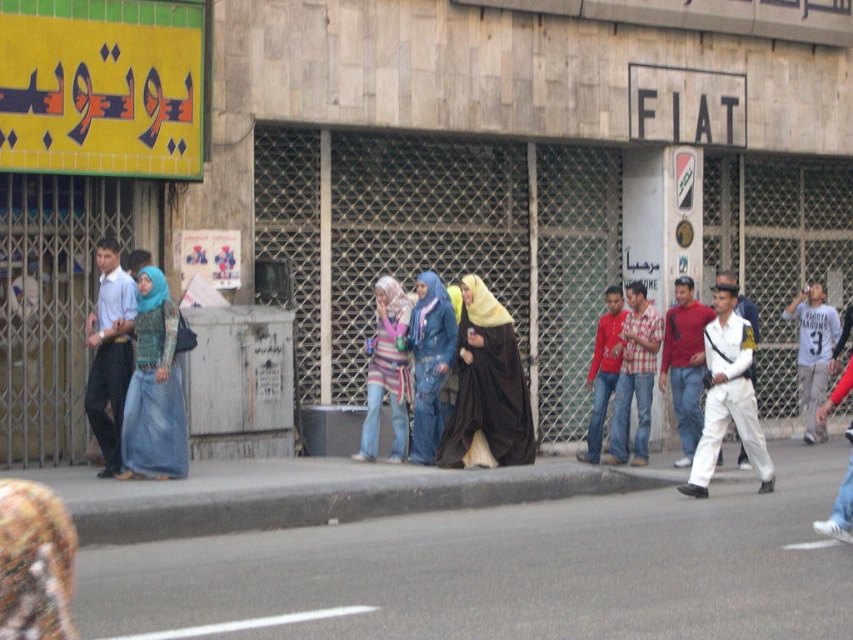
Question: Which point appears closest to the camera in this image?

Choices:
 (A) (169, 410)
 (B) (610, 324)

Answer: (A)

Question: Does denim fabric hijab at center have a lesser width compared to striped fabric scarf at center?

Choices:
 (A) yes
 (B) no

Answer: (A)

Question: Which of the following is the closest to the observer?

Choices:
 (A) (368, 413)
 (B) (509, 448)
 (C) (172, 467)
 (D) (426, 280)

Answer: (C)

Question: From the image, what is the correct spatial relationship of denim dress at left in relation to denim fabric hijab at center?

Choices:
 (A) below
 (B) above

Answer: (B)

Question: Does denim dress at left have a smaller size compared to denim fabric hijab at center?

Choices:
 (A) no
 (B) yes

Answer: (A)

Question: Among these points, which one is farthest from the camera?

Choices:
 (A) (645, 353)
 (B) (160, 477)
 (C) (96, 378)

Answer: (A)